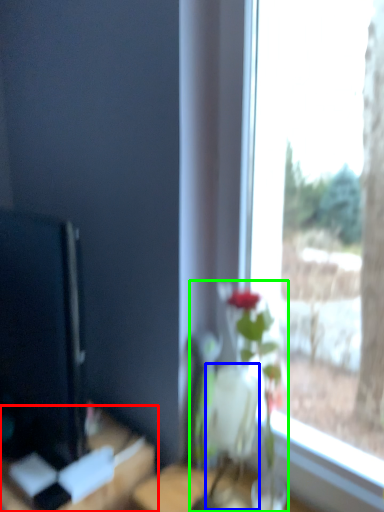
Question: Which is farther away from table (highlighted by a red box)? vase (highlighted by a blue box) or houseplant (highlighted by a green box)?

Choices:
 (A) vase
 (B) houseplant

Answer: (A)